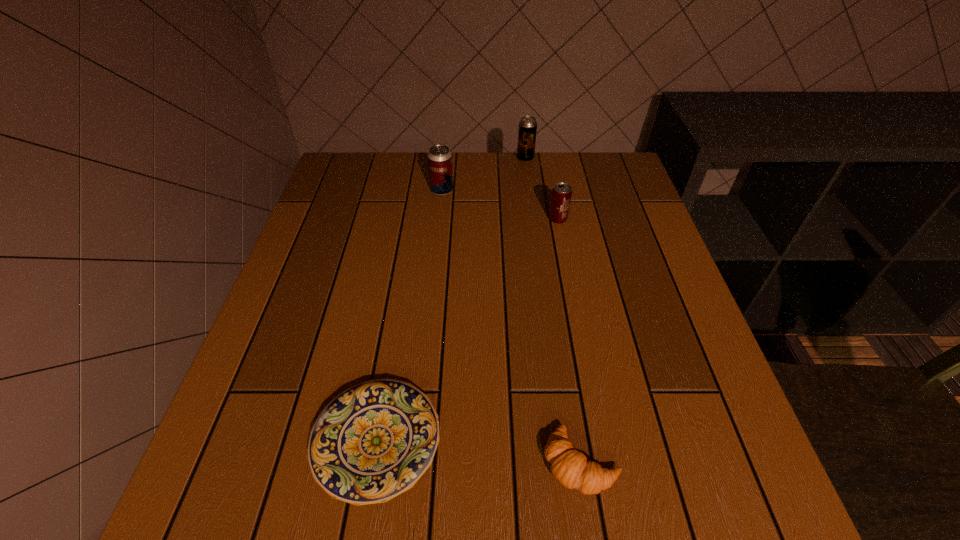
At what (x,y) coordinates should I click in order to perform the action: click on free space at the right edge of the desktop. Please return your answer as a coordinate pair (x, y). The height and width of the screenshot is (540, 960). Looking at the image, I should click on (677, 439).

You are a GUI agent. You are given a task and a screenshot of the screen. Output one action in this format:
    pyautogui.click(x=<x>, y=<y>)
    Task: Click on the free location at the far left corner
    The image size is (960, 540).
    Given the screenshot: What is the action you would take?
    pyautogui.click(x=372, y=157)

Image resolution: width=960 pixels, height=540 pixels. In the image, there is a desktop. Find the location of `vacant space at the near left corner`. vacant space at the near left corner is located at coordinates coord(269,498).

Locate an element on the screen. This screenshot has height=540, width=960. vacant space at the far right corner of the desktop is located at coordinates (588, 164).

Locate an element on the screen. This screenshot has height=540, width=960. vacant region at the near right corner of the desktop is located at coordinates (677, 484).

Locate an element on the screen. Image resolution: width=960 pixels, height=540 pixels. empty location between the second farthest beer can and the second shortest object is located at coordinates (512, 326).

Locate an element on the screen. This screenshot has width=960, height=540. vacant space that's between the third tallest object and the second beer can from left to right is located at coordinates (541, 188).

Identify the location of empty space between the rightmost beer can and the second beer can from right to left. (541, 188).

The width and height of the screenshot is (960, 540). What are the coordinates of `vacant point located between the farthest beer can and the second nearest beer can` in the screenshot? It's located at (484, 174).

Where is `vacant space that is in between the leftmost beer can and the farthest object`? Image resolution: width=960 pixels, height=540 pixels. vacant space that is in between the leftmost beer can and the farthest object is located at coordinates (484, 174).